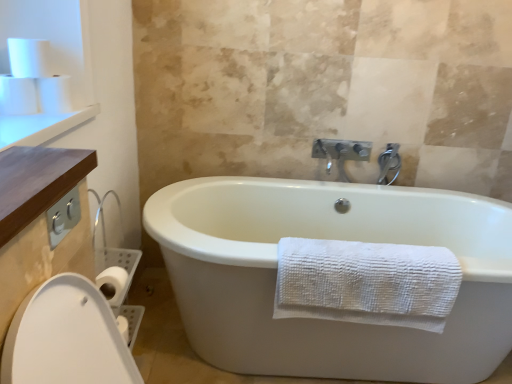
Question: Considering the positions of point (23, 178) and point (6, 87), is point (23, 178) closer or farther from the camera than point (6, 87)?

Choices:
 (A) farther
 (B) closer

Answer: (B)

Question: Is brown wood counter at upper left, which appears as the 2th counter top when viewed from the back, inside the boundaries of white matte toilet paper at upper left, placed as the third toilet paper when sorted from right to left, or outside?

Choices:
 (A) outside
 (B) inside

Answer: (A)

Question: Which is nearer to the brown wood counter at upper left, which is the 1th counter top in bottom-to-top order?

Choices:
 (A) white matte toilet paper at upper left, the 2th toilet paper positioned from the left
 (B) white matte toilet paper at upper left, which appears as the first toilet paper when viewed from the left
 (C) white matte toilet paper at upper left, which is the 1th toilet paper from right to left
 (D) wooden counter at upper left, the 1th counter top when ordered from back to front
 (E) silver metallic faucet at upper center

Answer: (D)

Question: Based on their relative distances, which object is nearer to the brown wood counter at upper left, which appears as the 2th counter top when viewed from the back?

Choices:
 (A) white matte toilet paper at upper left, placed as the third toilet paper when sorted from right to left
 (B) wooden counter at upper left, which appears as the first counter top when viewed from the left
 (C) white matte toilet paper at upper left, arranged as the second toilet paper when viewed from the right
 (D) silver metallic faucet at upper center
 (E) white matte toilet paper at upper left, which is the 1th toilet paper from right to left

Answer: (B)